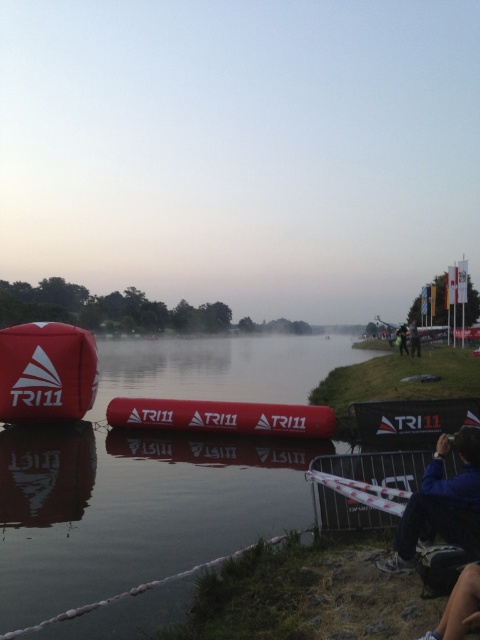
Is point (55, 380) positioned after point (196, 428)?

No, (55, 380) is closer to viewer.

Does matte red buoy at left have a greater height compared to matte red buoy at center?

Yes, matte red buoy at left is taller than matte red buoy at center.

This screenshot has height=640, width=480. I want to click on matte red buoy at left, so click(x=47, y=372).

Find the location of `matte red buoy at left`. matte red buoy at left is located at coordinates tap(47, 372).

Is matte red buoy at left below blue fabric jacket at lower right?

No.

Between point (44, 401) and point (441, 515), which one is positioned in front?

Point (441, 515)

Locate an element on the screen. The height and width of the screenshot is (640, 480). matte red buoy at left is located at coordinates (47, 372).

Who is taller, blue fabric jacket at lower right or matte red buoy at center?

blue fabric jacket at lower right is taller.

Where is `blue fabric jacket at lower right`? blue fabric jacket at lower right is located at coordinates (442, 504).

Is point (464, 538) less distant than point (253, 406)?

That is True.

Where is `blue fabric jacket at lower right`? This screenshot has height=640, width=480. blue fabric jacket at lower right is located at coordinates (442, 504).